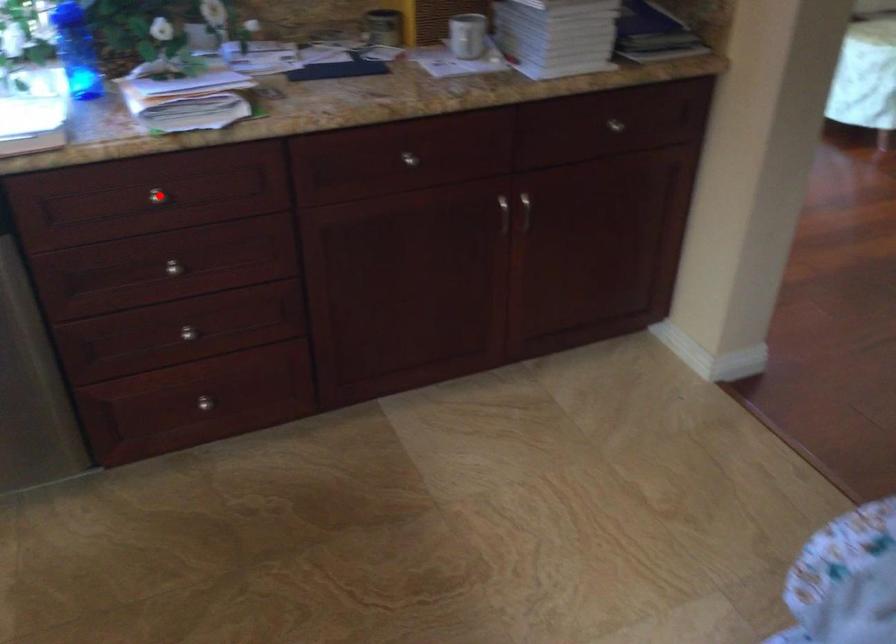
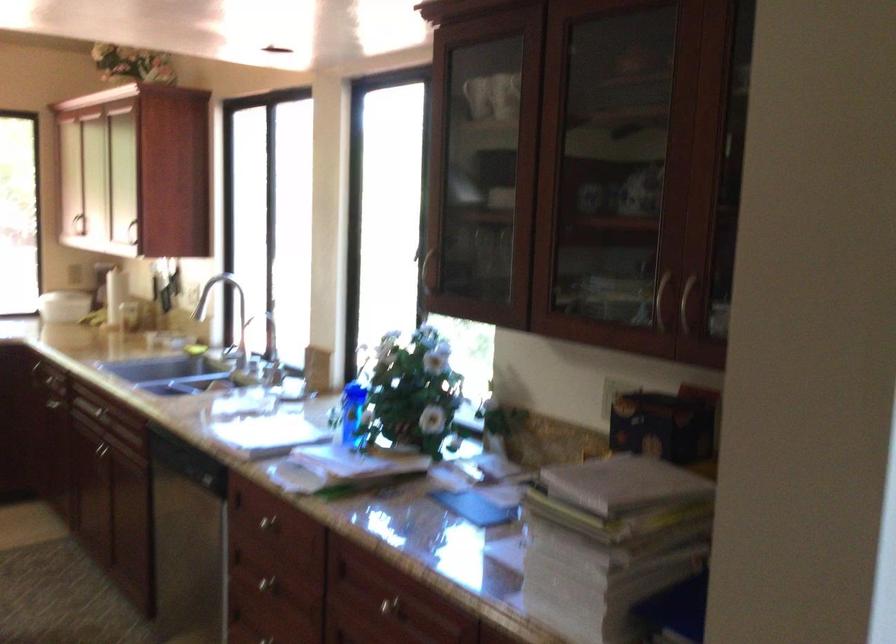
Question: I am providing you with two images of the same scene from different viewpoints. Image1 has a red point marked. In image2, the corresponding 3D location appears at what relative position? Reply with the corresponding letter.

Choices:
 (A) Closer
 (B) Farther

Answer: (B)